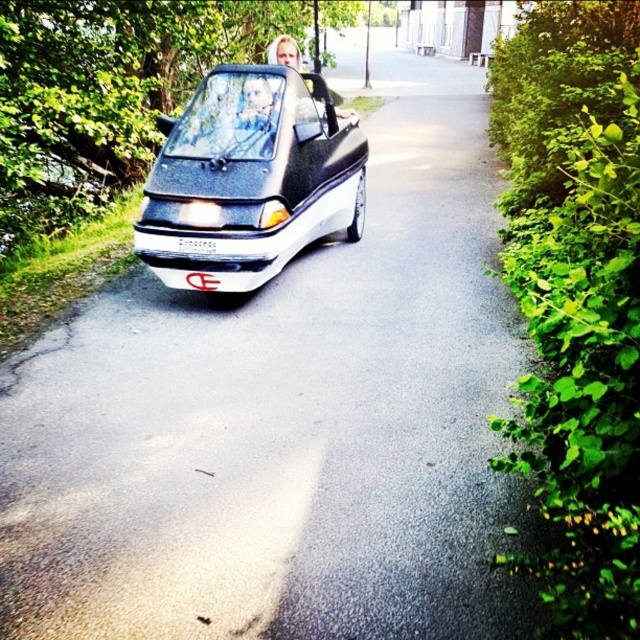
You are a pedestrian standing on the side of the road and see the futuristic vehicle passing by. You notice the blonde hair at center and the white plastic license plate at center. Which object is closer to the right side of the road?

The blonde hair at center is closer to the right side of the road because it is positioned to the right of the white plastic license plate at center.

You are navigating a futuristic vehicle along a narrow road surrounded by greenery. You notice two points marked on your GPS navigation system at coordinates point (x=221, y=285) and point (x=209, y=246). Based on the scene, which point is closer to the front of the vehicle?

Point (x=209, y=246) is closer to the front of the vehicle because it is in front of point (x=221, y=285), which is behind it.